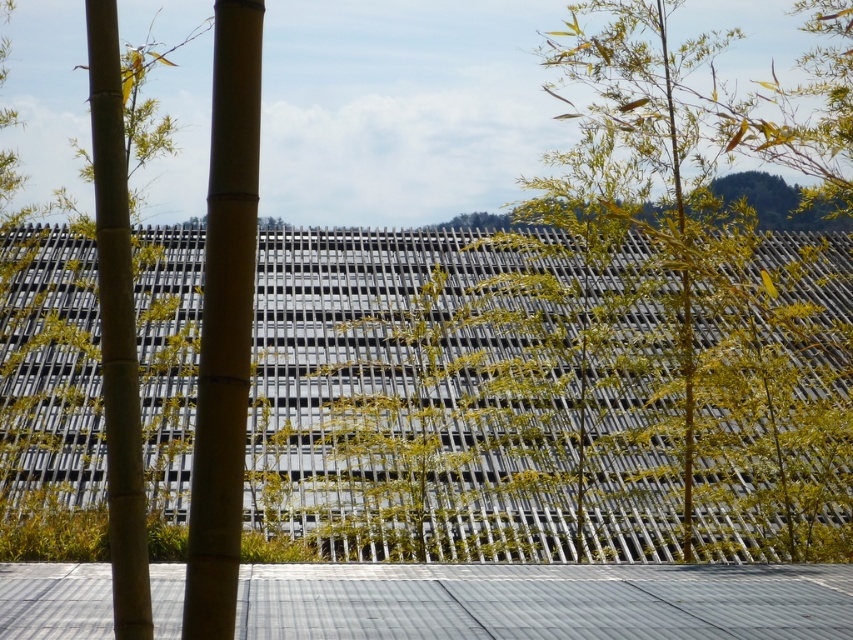
Question: Is smooth bamboo pole at center further to the viewer compared to green bamboo at left?

Choices:
 (A) no
 (B) yes

Answer: (A)

Question: Which object appears closest to the camera in this image?

Choices:
 (A) green bamboo forest at center
 (B) green bamboo at left
 (C) smooth bamboo pole at center

Answer: (C)

Question: Estimate the real-world distances between objects in this image. Which object is closer to the green bamboo forest at center?

Choices:
 (A) green bamboo at left
 (B) smooth bamboo pole at center

Answer: (A)

Question: Can you confirm if green bamboo forest at center is positioned above green bamboo at left?

Choices:
 (A) no
 (B) yes

Answer: (B)

Question: Does green bamboo forest at center have a greater width compared to green bamboo at left?

Choices:
 (A) yes
 (B) no

Answer: (A)

Question: Which object appears farthest from the camera in this image?

Choices:
 (A) green bamboo forest at center
 (B) green bamboo at left
 (C) smooth bamboo pole at center

Answer: (A)